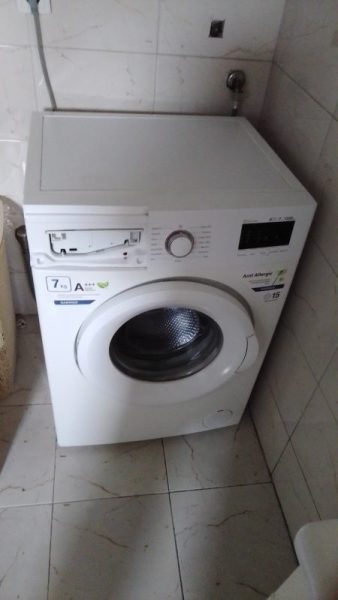
Identify the location of wash machine , glass ,door  ,cycle button. (122, 173), (168, 334), (96, 371), (178, 244).